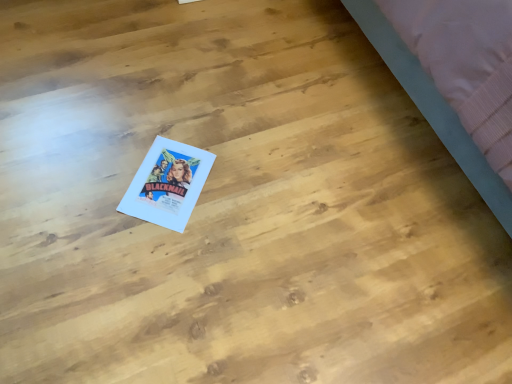
Find the location of a particular element. The image size is (512, 384). vacant area to the right of white paper at center is located at coordinates (240, 195).